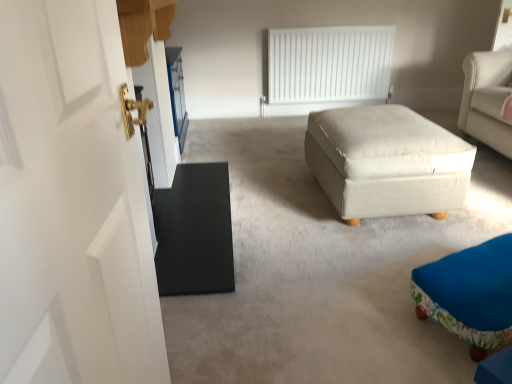
This screenshot has height=384, width=512. What are the coordinates of `vacant area on the back side of floral fabric ottoman at lower right` in the screenshot? It's located at (416, 236).